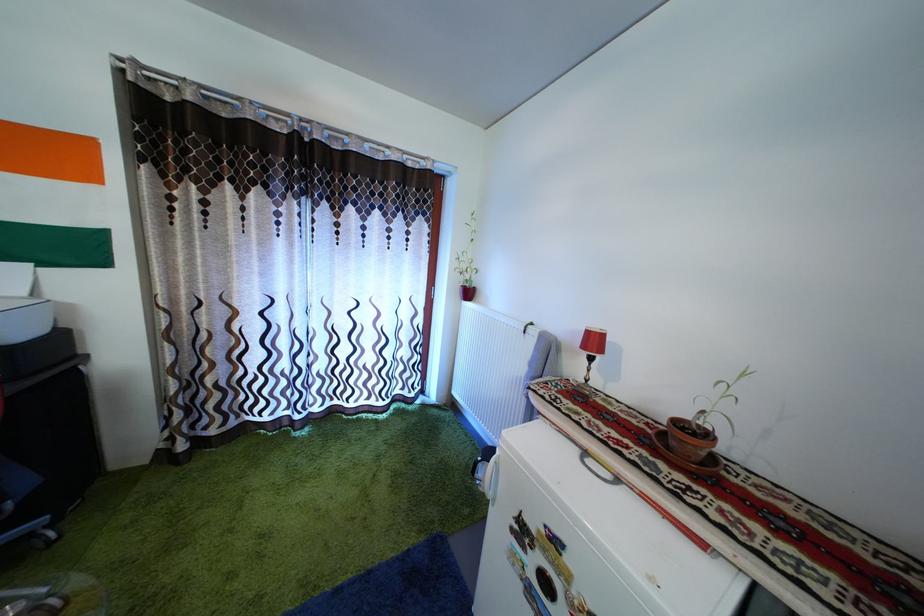
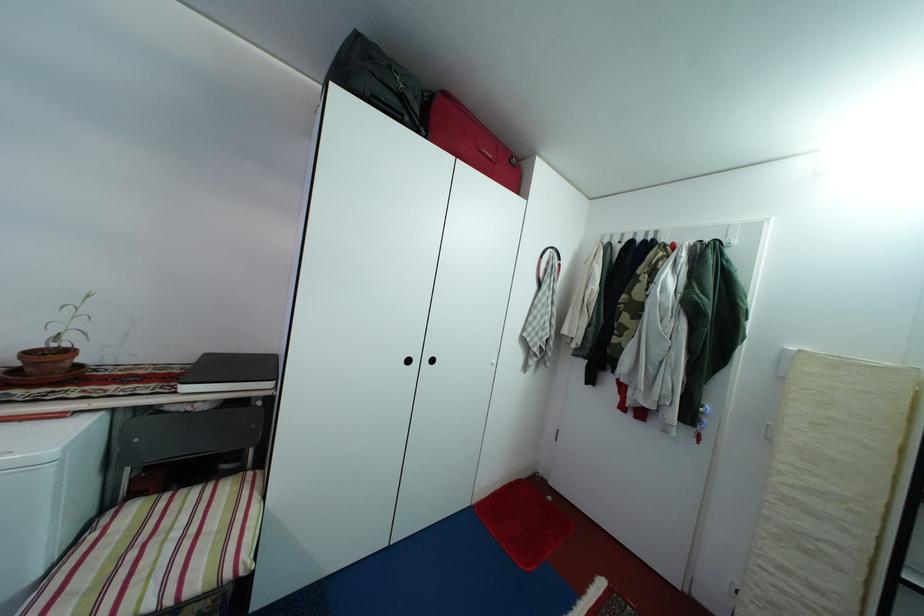
Question: The camera is either moving clockwise (left) or counter-clockwise (right) around the object. The first image is from the beginning of the video and the second image is from the end. Is the camera moving left or right when shooting the video?

Choices:
 (A) Left
 (B) Right

Answer: (A)